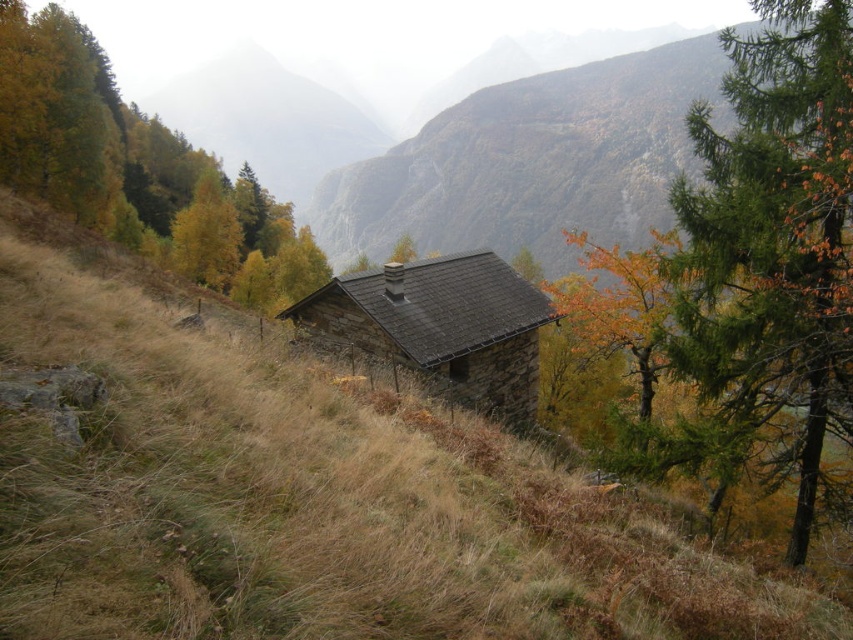
You are standing at the entrance of the rustic stone building with a dark, sloped roof. Looking towards the mountains, you notice the brown grassy area at center. Can you determine the exact coordinates of the brown grassy at center in the image?

The brown grassy at center is located at point (306, 493), so its coordinates are precisely at those measurements.